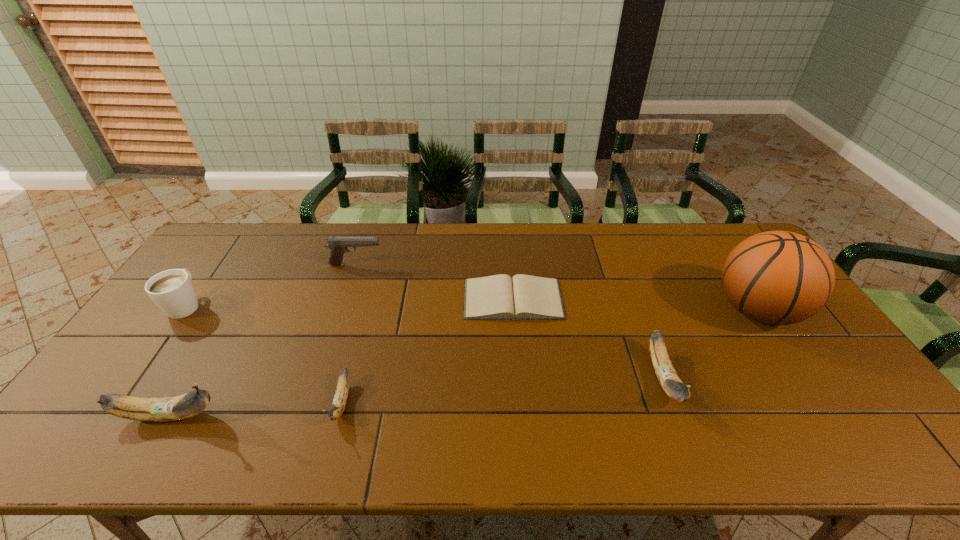
To make them evenly spaced by inserting another banana among them, please locate a vacant spot for this new banana. Please provide its 2D coordinates. Your answer should be formatted as a tuple, i.e. [(x, y)], where the tuple contains the x and y coordinates of a point satisfying the conditions above.

[(507, 390)]